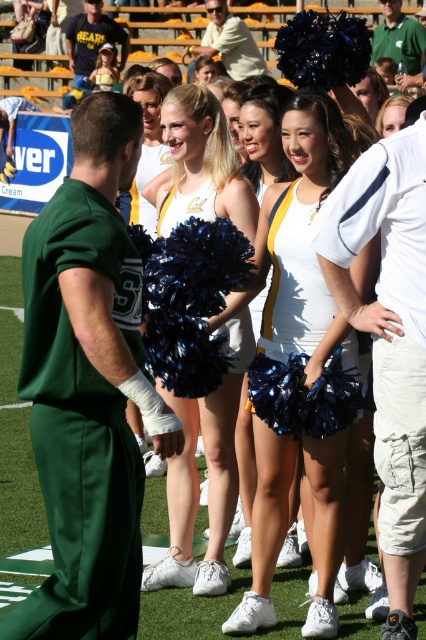
Question: Which object is farther from the camera taking this photo?

Choices:
 (A) shiny blue pom-poms at center
 (B) white matte cheerleader uniform at center
 (C) green fabric pants at left

Answer: (A)

Question: Can you confirm if green fabric pants at left is wider than white matte cheerleader uniform at center?

Choices:
 (A) yes
 (B) no

Answer: (A)

Question: Is white matte cheerleader uniform at center positioned behind shiny blue pom-poms at center?

Choices:
 (A) no
 (B) yes

Answer: (A)

Question: Is the position of white matte cheerleader uniform at center more distant than that of shiny blue pom-poms at center?

Choices:
 (A) no
 (B) yes

Answer: (A)

Question: Considering the real-world distances, which object is farthest from the white cotton cheerleader pom-poms at center?

Choices:
 (A) green fabric pants at left
 (B) white matte cheerleader uniform at center

Answer: (A)

Question: Which object appears farthest from the camera in this image?

Choices:
 (A) white matte cheerleader uniform at center
 (B) green fabric pants at left
 (C) shiny blue pom-poms at center

Answer: (C)